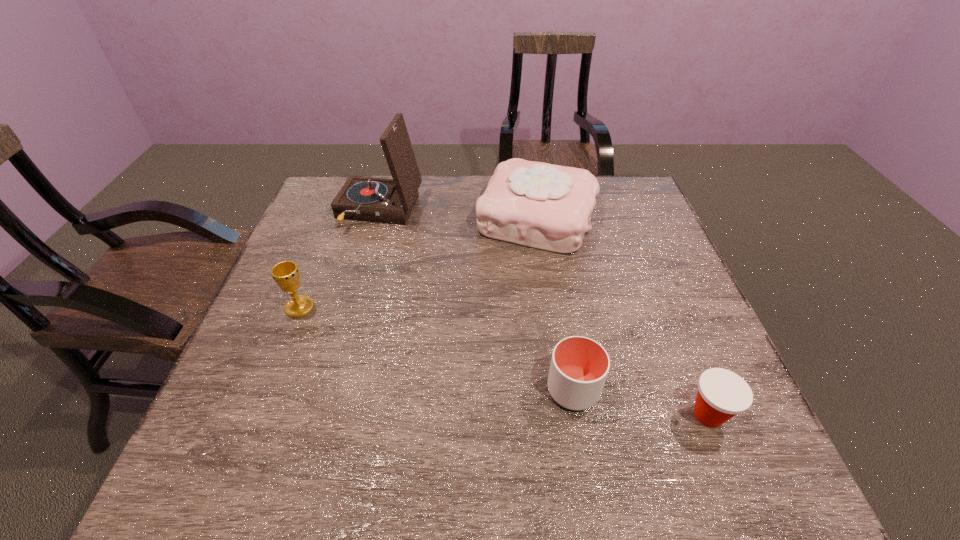
You are a GUI agent. You are given a task and a screenshot of the screen. Output one action in this format:
    pyautogui.click(x=<x>, y=<y>)
    Task: Click on the free space located on the back of the shortest object
    
    Given the screenshot: What is the action you would take?
    pyautogui.click(x=647, y=264)

The image size is (960, 540). Find the location of `phonograph record present at the far edge`. phonograph record present at the far edge is located at coordinates (369, 199).

This screenshot has height=540, width=960. I want to click on cake that is at the far edge, so click(535, 204).

This screenshot has height=540, width=960. I want to click on phonograph record located at the left edge, so click(369, 199).

Locate an element on the screen. Image resolution: width=960 pixels, height=540 pixels. chalice situated at the left edge is located at coordinates (286, 274).

Identify the location of object that is at the right edge. (722, 394).

I want to click on object situated at the far left corner, so click(369, 199).

The width and height of the screenshot is (960, 540). What are the coordinates of `vacant space at the far edge` in the screenshot? It's located at (435, 181).

Where is `vacant area at the near edge`? This screenshot has width=960, height=540. vacant area at the near edge is located at coordinates (298, 481).

Identify the location of vacant space at the left edge. (276, 332).